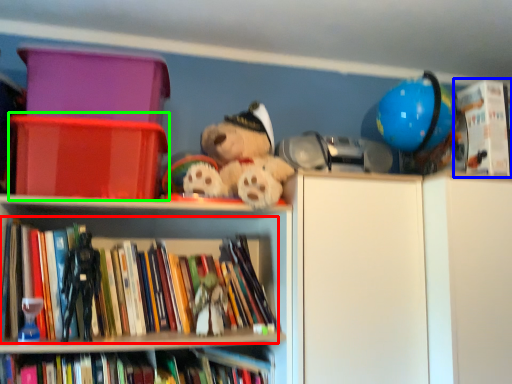
Question: Which is nearer to the book (highlighted by a red box)? book (highlighted by a blue box) or storage box (highlighted by a green box).

Choices:
 (A) book
 (B) storage box

Answer: (B)